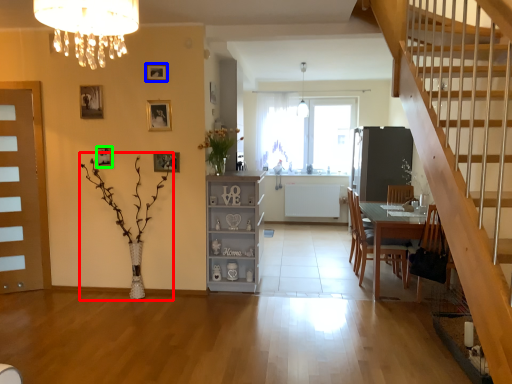
Question: Which is nearer to the plant (highlighted by a red box)? picture frame (highlighted by a blue box) or picture frame (highlighted by a green box).

Choices:
 (A) picture frame
 (B) picture frame

Answer: (B)